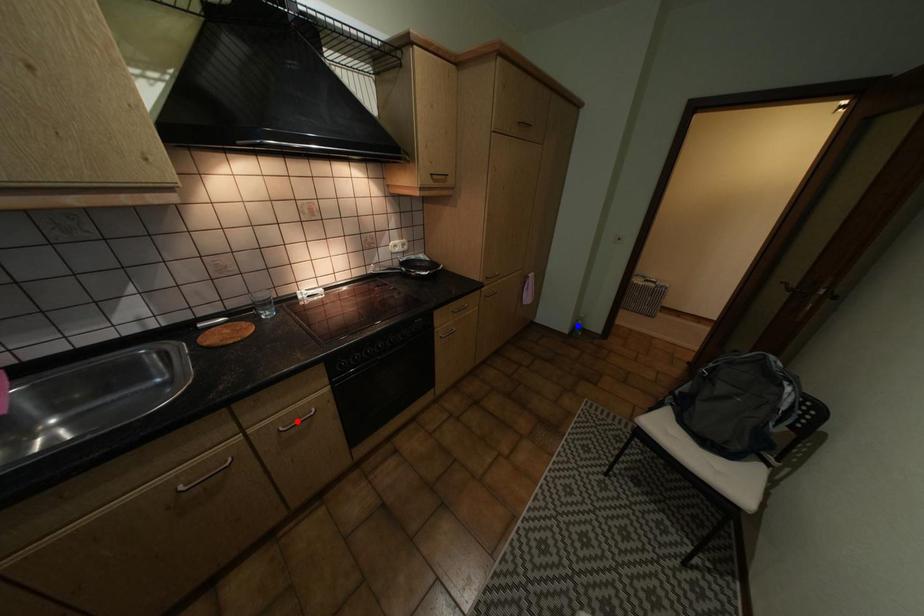
Question: In the image, two points are highlighted. Which point is nearer to the camera? Reply with the corresponding letter.

Choices:
 (A) blue point
 (B) red point

Answer: (B)